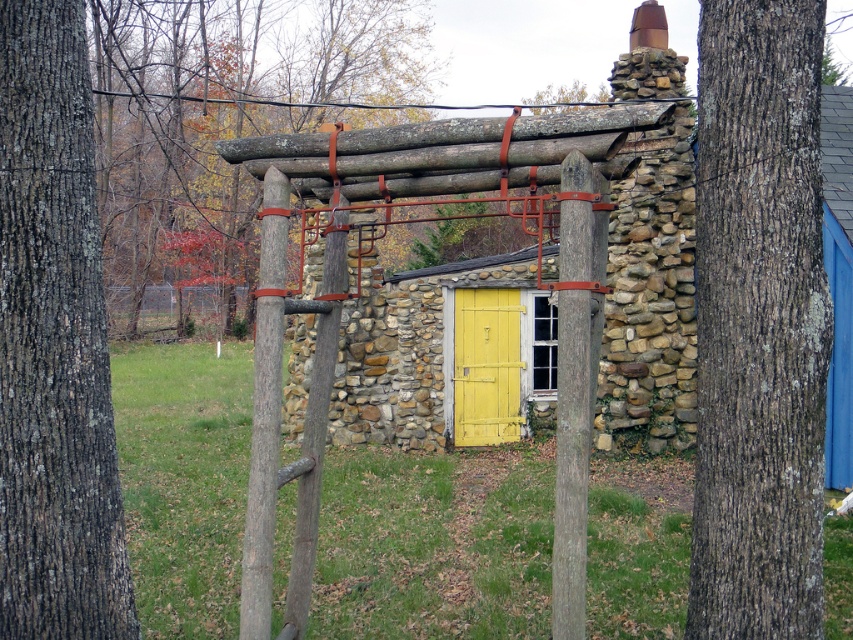
Which of these two, brown rough wood at center or brown wood pole at center, stands taller?

Standing taller between the two is brown rough wood at center.

Does brown rough wood at center have a larger size compared to brown wood pole at center?

Correct, brown rough wood at center is larger in size than brown wood pole at center.

Identify the location of brown rough wood at center. pyautogui.click(x=224, y=129).

Is brown rough bark tree trunk at right to the left of smooth brown wooden post at center from the viewer's perspective?

In fact, brown rough bark tree trunk at right is to the right of smooth brown wooden post at center.

Is point (809, 378) closer to viewer compared to point (567, 285)?

No, it is not.

Does point (718, 500) come farther from viewer compared to point (563, 378)?

That is True.

Find the location of a particular element. brown rough bark tree trunk at right is located at coordinates (759, 323).

Does point (279, 3) lie behind point (564, 598)?

Yes, it is behind point (564, 598).

Is the position of brown rough wood at center less distant than that of smooth brown wooden post at center?

No, brown rough wood at center is behind smooth brown wooden post at center.

Is point (113, 60) closer to viewer compared to point (578, 609)?

No, (113, 60) is behind (578, 609).

Locate an element on the screen. The height and width of the screenshot is (640, 853). brown rough wood at center is located at coordinates (224, 129).